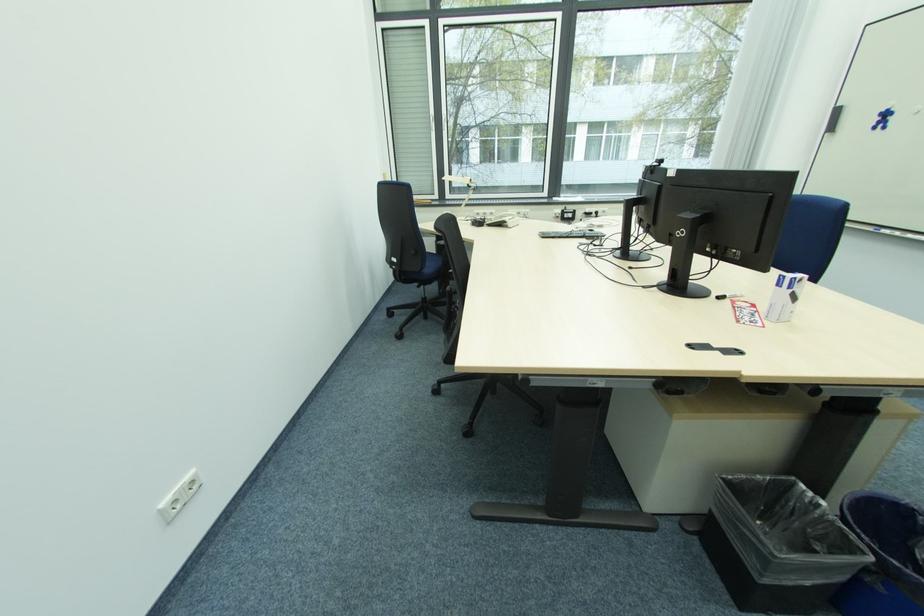
Find the location of `white printed cup`. white printed cup is located at coordinates (784, 297).